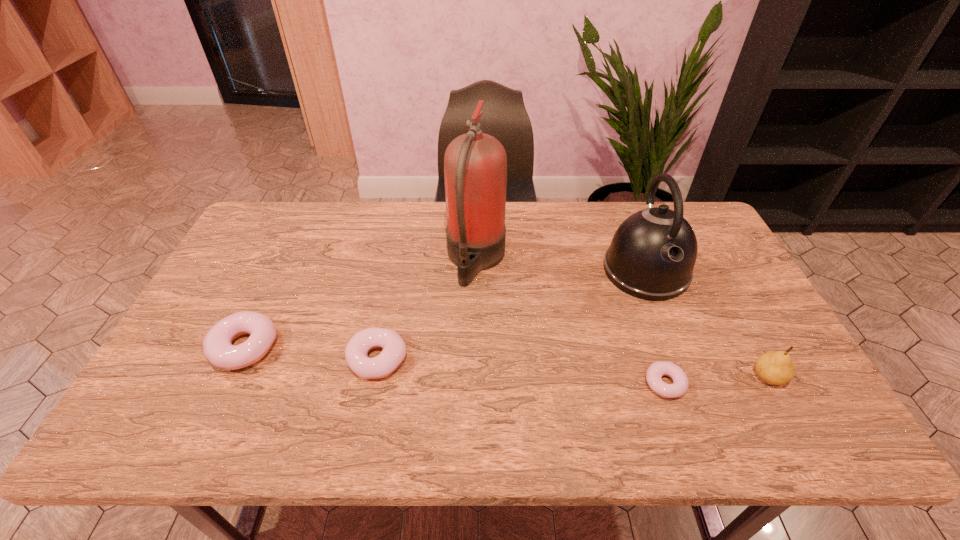
Image resolution: width=960 pixels, height=540 pixels. What are the coordinates of `the leftmost doughnut` in the screenshot? It's located at (218, 349).

Identify the location of the second doughnut from left to right. (394, 350).

The image size is (960, 540). Identify the location of the second shortest doughnut. (394, 350).

Image resolution: width=960 pixels, height=540 pixels. What are the coordinates of `the rightmost doughnut` in the screenshot? It's located at (656, 370).

This screenshot has width=960, height=540. I want to click on the shortest object, so click(x=656, y=370).

At what (x,y) coordinates should I click in order to perform the action: click on the fourth object from right to left. Please return your answer as a coordinate pair (x, y). The image size is (960, 540). Looking at the image, I should click on (475, 164).

Identify the location of fire extinguisher. (475, 164).

Image resolution: width=960 pixels, height=540 pixels. I want to click on kettle, so click(652, 255).

Locate an element on the screen. The image size is (960, 540). pear is located at coordinates (775, 367).

Identify the location of the third tallest object. (775, 367).